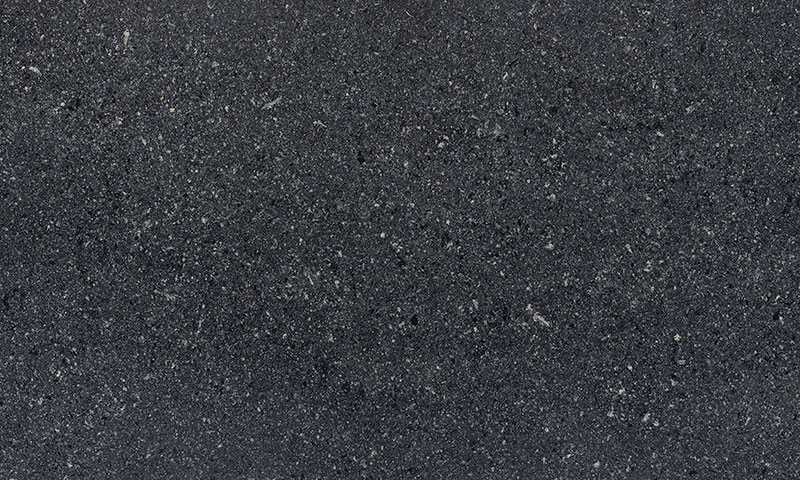
This screenshot has width=800, height=480. What are the coordinates of `corner` in the screenshot? It's located at (778, 22).